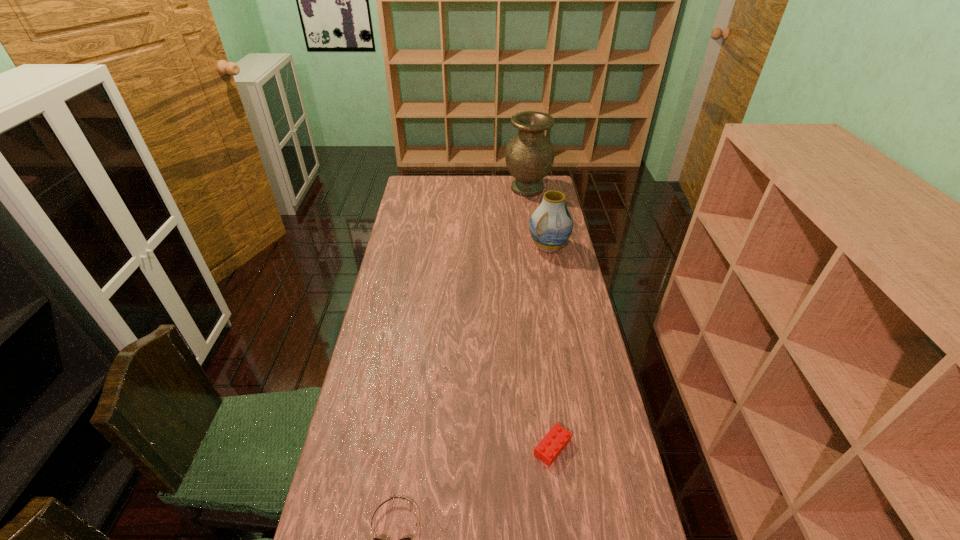
The height and width of the screenshot is (540, 960). What are the coordinates of `the farther vase` in the screenshot? It's located at (529, 156).

Where is `the farthest object`? This screenshot has width=960, height=540. the farthest object is located at coordinates (529, 156).

Locate an element on the screen. This screenshot has width=960, height=540. the third nearest object is located at coordinates (551, 224).

At what (x,y) coordinates should I click in order to perform the action: click on the nearer vase. Please return your answer as a coordinate pair (x, y). The height and width of the screenshot is (540, 960). Looking at the image, I should click on (551, 224).

Find the location of a particular element. the third farthest object is located at coordinates (549, 448).

Locate an element on the screen. The image size is (960, 540). free spot located 0.340m on the front of the farther vase is located at coordinates (536, 242).

Identify the location of free space located on the back of the shorter vase. (540, 203).

What are the coordinates of `free space located 0.240m on the left of the third farthest object` in the screenshot? It's located at (444, 447).

Image resolution: width=960 pixels, height=540 pixels. In order to click on object that is at the far edge in this screenshot , I will do click(x=529, y=156).

You are a GUI agent. You are given a task and a screenshot of the screen. Output one action in this format:
    pyautogui.click(x=<x>, y=<y>)
    Task: Click on the Lego at the right edge
    The height and width of the screenshot is (540, 960).
    Given the screenshot: What is the action you would take?
    pyautogui.click(x=549, y=448)